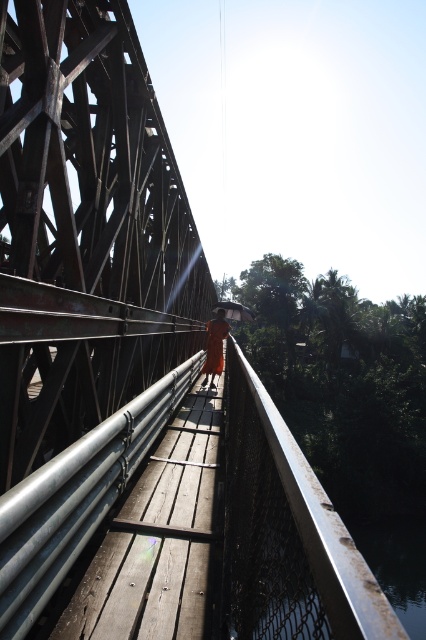
Question: Which point is closer to the camera taking this photo?

Choices:
 (A) (247, 316)
 (B) (282, 499)

Answer: (B)

Question: Does rusty metal river at lower center lie behind orange cloth at center?

Choices:
 (A) no
 (B) yes

Answer: (B)

Question: Observing the image, what is the correct spatial positioning of rusty metal river at lower center in reference to transparent plastic umbrella at center?

Choices:
 (A) right
 (B) left

Answer: (A)

Question: Which of these objects is positioned farthest from the rusty metal river at lower center?

Choices:
 (A) transparent plastic umbrella at center
 (B) metallic silver rail at center

Answer: (B)

Question: Considering the relative positions of metallic silver rail at center and rusty metal river at lower center in the image provided, where is metallic silver rail at center located with respect to rusty metal river at lower center?

Choices:
 (A) left
 (B) right

Answer: (A)

Question: Which point appears farthest from the camera in this image?

Choices:
 (A) (253, 314)
 (B) (290, 595)
 (C) (210, 385)
 (D) (359, 534)

Answer: (D)